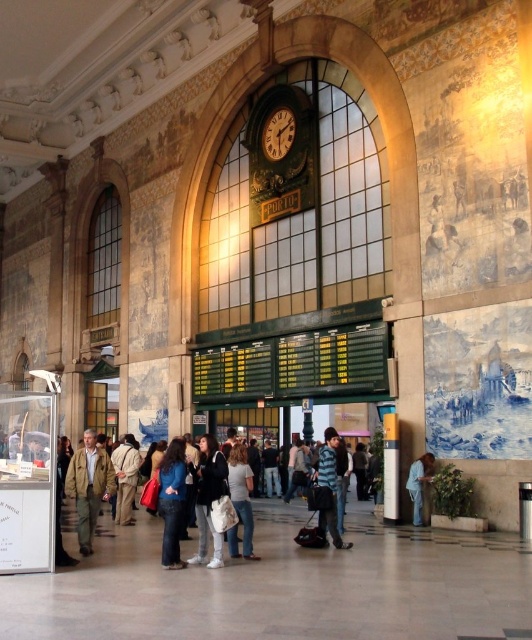
You are a photographer positioned at the entrance of the train station. You want to take a photo that clearly shows both the light gray cotton shirt at center and the light brown leather jacket at center. However, you notice that one of them is blocking the view of the other. Which item is obstructing the other?

The light gray cotton shirt at center is in front of the light brown leather jacket at center, so it is obstructing the view of the light brown leather jacket at center.

You are a traveler who just arrived at the train station and are looking for your luggage. You see a denim jacket at center and a blue fabric shirt at lower right. Which item is closer to the left side of the station?

The denim jacket at center is positioned on the left side of blue fabric shirt at lower right, so it is closer to the left side of the station.